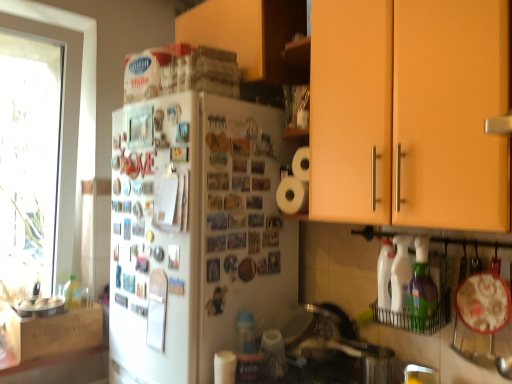
Where is `green plastic bottle at lower right, which is the first bottle in front-to-back order`? Image resolution: width=512 pixels, height=384 pixels. green plastic bottle at lower right, which is the first bottle in front-to-back order is located at coordinates (422, 287).

This screenshot has width=512, height=384. What are the coordinates of `matte orange cabinet at upper right, the second cabinetry ordered from the bottom` in the screenshot? It's located at (409, 113).

This screenshot has width=512, height=384. What do you see at coordinates (401, 274) in the screenshot?
I see `white plastic spray bottle at lower right, the 1th bottle in the back-to-front sequence` at bounding box center [401, 274].

At what (x,y) coordinates should I click in order to perform the action: click on green plastic bottle at lower right, which is the first bottle in front-to-back order. Please return your answer as a coordinate pair (x, y). Looking at the image, I should click on (422, 287).

Which is less distant, (219, 378) or (352, 60)?

Point (219, 378) is farther from the camera than point (352, 60).

Consider the image. Could you tell me if white matte paper towel at lower center is facing matte orange cabinet at upper right, placed as the second cabinetry when sorted from top to bottom?

No, white matte paper towel at lower center does not turn towards matte orange cabinet at upper right, placed as the second cabinetry when sorted from top to bottom.

In the scene shown: From a real-world perspective, between white matte paper towel at lower center and matte orange cabinet at upper right, placed as the second cabinetry when sorted from top to bottom, who is vertically higher?

matte orange cabinet at upper right, placed as the second cabinetry when sorted from top to bottom, is physically above.

Is white matte paper towel at lower center not near matte orange cabinet at upper right, the first cabinetry from the right?

No, white matte paper towel at lower center is not far from matte orange cabinet at upper right, the first cabinetry from the right.

From a real-world perspective, relative to white matte paper towel at lower center, is matte orange cabinet at upper right, the first cabinetry from the right, vertically above or below?

In terms of real-world spatial position, matte orange cabinet at upper right, the first cabinetry from the right, is above white matte paper towel at lower center.

Which object is closer to the camera taking this photo, matte orange cabinet at upper right, placed as the second cabinetry when sorted from top to bottom, or white matte paper towel at lower center?

matte orange cabinet at upper right, placed as the second cabinetry when sorted from top to bottom, is closer to the camera.

Considering the points (417, 58) and (217, 368), which point is behind, point (417, 58) or point (217, 368)?

The point (217, 368) is farther.

How different are the orientations of matte orange cabinet at upper right, the second cabinetry ordered from the bottom, and white matte paper towel at lower center in degrees?

matte orange cabinet at upper right, the second cabinetry ordered from the bottom, and white matte paper towel at lower center are facing 0.703 degrees away from each other.

Where is `the 1st bottle above the white matte paper towel at lower center (from the image's perspective)`? Image resolution: width=512 pixels, height=384 pixels. the 1st bottle above the white matte paper towel at lower center (from the image's perspective) is located at coordinates (422, 287).

Can you confirm if white matte paper towel at lower center is wider than green plastic bottle at lower right, which is the second bottle in back-to-front order?

No, white matte paper towel at lower center is not wider than green plastic bottle at lower right, which is the second bottle in back-to-front order.

Which of these two, white matte paper towel at lower center or green plastic bottle at lower right, which is the first bottle in front-to-back order, is smaller?

white matte paper towel at lower center is smaller.

Does white matte paper towel at lower center lie behind green plastic bottle at lower right, which is the second bottle in back-to-front order?

Yes, it is.

From a real-world perspective, is wooden cabinet at upper center, marked as the first cabinetry in a top-to-bottom arrangement, located beneath wooden crate at left, which appears as the first cabinetry when ordered from the bottom?

Incorrect, from a real-world perspective, wooden cabinet at upper center, marked as the first cabinetry in a top-to-bottom arrangement, is higher than wooden crate at left, which appears as the first cabinetry when ordered from the bottom.

Looking at this image, which is closer, (210, 4) or (93, 304)?

Clearly, point (210, 4) is closer to the camera than point (93, 304).

This screenshot has width=512, height=384. What are the coordinates of `the 2nd cabinetry positioned above the wooden crate at left, which is counted as the 1th cabinetry, starting from the left (from a real-world perspective)` in the screenshot? It's located at (249, 34).

Is wooden cabinet at upper center, marked as the first cabinetry in a top-to-bottom arrangement, behind wooden crate at left, which appears as the first cabinetry when ordered from the bottom?

No.

Which point is more distant from viewer, (x=73, y=346) or (x=234, y=374)?

Positioned behind is point (x=73, y=346).

Is wooden crate at left, acting as the third cabinetry starting from the top, thinner than white matte paper towel at lower center?

Incorrect, the width of wooden crate at left, acting as the third cabinetry starting from the top, is not less than that of white matte paper towel at lower center.

Would you say wooden crate at left, which appears as the first cabinetry when ordered from the bottom, is outside white matte paper towel at lower center?

That's correct, wooden crate at left, which appears as the first cabinetry when ordered from the bottom, is outside of white matte paper towel at lower center.

Is white plastic spray bottle at lower right, the 1th bottle in the back-to-front sequence, inside or outside of green plastic bottle at lower right, which is the first bottle in front-to-back order?

white plastic spray bottle at lower right, the 1th bottle in the back-to-front sequence, is not enclosed by green plastic bottle at lower right, which is the first bottle in front-to-back order.

From a real-world perspective, is white plastic spray bottle at lower right, the 1th bottle in the back-to-front sequence, above or below green plastic bottle at lower right, which is the second bottle in back-to-front order?

In terms of real-world spatial position, white plastic spray bottle at lower right, the 1th bottle in the back-to-front sequence, is above green plastic bottle at lower right, which is the second bottle in back-to-front order.

Is white plastic spray bottle at lower right, the second bottle in the front-to-back sequence, next to green plastic bottle at lower right, which is the second bottle in back-to-front order, and touching it?

Yes, white plastic spray bottle at lower right, the second bottle in the front-to-back sequence, and green plastic bottle at lower right, which is the second bottle in back-to-front order, clearly make contact.

Considering the relative positions of white matte refrigerator at center and white plastic spray bottle at lower right, the second bottle in the front-to-back sequence, in the image provided, is white matte refrigerator at center behind white plastic spray bottle at lower right, the second bottle in the front-to-back sequence,?

Yes, white matte refrigerator at center is further from the camera.

The image size is (512, 384). In the image, there is a white plastic spray bottle at lower right, the second bottle in the front-to-back sequence. Identify the location of refrigerator below it (from the image's perspective). (194, 233).

Based on their positions, is white matte refrigerator at center located to the left or right of white plastic spray bottle at lower right, the 1th bottle in the back-to-front sequence?

Clearly, white matte refrigerator at center is on the left of white plastic spray bottle at lower right, the 1th bottle in the back-to-front sequence, in the image.

Find the location of a particular element. paper towel on the left of matte orange cabinet at upper right, the first cabinetry from the right is located at coordinates (224, 367).

There is a white matte paper towel at lower center. Find the location of `the 2nd cabinetry above it (from a real-world perspective)`. the 2nd cabinetry above it (from a real-world perspective) is located at coordinates (409, 113).

From the image, which object appears to be nearer to white matte paper towel at lower center, wooden crate at left, which is counted as the 1th cabinetry, starting from the left, or white matte refrigerator at center?

Based on the image, white matte refrigerator at center appears to be nearer to white matte paper towel at lower center.

Which object lies nearer to the anchor point white matte refrigerator at center, white matte paper towel at lower center or wooden crate at left, which is counted as the 1th cabinetry, starting from the left?

The object closer to white matte refrigerator at center is white matte paper towel at lower center.

Looking at this image, estimate the real-world distances between objects in this image. Which object is closer to wooden crate at left, the third cabinetry viewed from the right, matte orange cabinet at upper right, the third cabinetry positioned from the left, or white matte paper towel at lower center?

white matte paper towel at lower center is positioned closer to the anchor wooden crate at left, the third cabinetry viewed from the right.

Estimate the real-world distances between objects in this image. Which object is further from matte orange cabinet at upper right, the third cabinetry positioned from the left, wooden cabinet at upper center, the 2th cabinetry viewed from the left, or wooden crate at left, which appears as the first cabinetry when ordered from the bottom?

Among the two, wooden crate at left, which appears as the first cabinetry when ordered from the bottom, is located further to matte orange cabinet at upper right, the third cabinetry positioned from the left.

Based on the photo, based on their spatial positions, is wooden cabinet at upper center, acting as the third cabinetry starting from the bottom, or matte orange cabinet at upper right, the third cabinetry positioned from the left, closer to wooden crate at left, the third cabinetry viewed from the right?

Among the two, wooden cabinet at upper center, acting as the third cabinetry starting from the bottom, is located nearer to wooden crate at left, the third cabinetry viewed from the right.

Which object lies nearer to the anchor point matte orange cabinet at upper right, the third cabinetry positioned from the left, white matte paper towel at lower center or white matte refrigerator at center?

white matte refrigerator at center lies closer to matte orange cabinet at upper right, the third cabinetry positioned from the left, than the other object.

When comparing their distances from wooden crate at left, which appears as the first cabinetry when ordered from the bottom, does wooden cabinet at upper center, acting as the third cabinetry starting from the bottom, or green plastic bottle at lower right, which is the first bottle in front-to-back order, seem closer?

Among the two, wooden cabinet at upper center, acting as the third cabinetry starting from the bottom, is located nearer to wooden crate at left, which appears as the first cabinetry when ordered from the bottom.

Which object lies nearer to the anchor point white plastic spray bottle at lower right, the second bottle in the front-to-back sequence, green plastic bottle at lower right, which is the first bottle in front-to-back order, or wooden crate at left, which is counted as the 1th cabinetry, starting from the left?

green plastic bottle at lower right, which is the first bottle in front-to-back order, is closer to white plastic spray bottle at lower right, the second bottle in the front-to-back sequence.

Where is `cabinetry between wooden crate at left, which is counted as the 1th cabinetry, starting from the left, and matte orange cabinet at upper right, the second cabinetry ordered from the bottom, in the horizontal direction`? This screenshot has height=384, width=512. cabinetry between wooden crate at left, which is counted as the 1th cabinetry, starting from the left, and matte orange cabinet at upper right, the second cabinetry ordered from the bottom, in the horizontal direction is located at coordinates (249, 34).

At what (x,y) coordinates should I click in order to perform the action: click on refrigerator located between wooden crate at left, the third cabinetry viewed from the right, and matte orange cabinet at upper right, the second cabinetry ordered from the bottom, in the left-right direction. Please return your answer as a coordinate pair (x, y). Looking at the image, I should click on (194, 233).

Where is `paper towel located between white matte refrigerator at center and green plastic bottle at lower right, which is the first bottle in front-to-back order, in the left-right direction`? The width and height of the screenshot is (512, 384). paper towel located between white matte refrigerator at center and green plastic bottle at lower right, which is the first bottle in front-to-back order, in the left-right direction is located at coordinates (224, 367).

Where is `bottle between matte orange cabinet at upper right, placed as the second cabinetry when sorted from top to bottom, and green plastic bottle at lower right, which is the first bottle in front-to-back order, in the vertical direction`? bottle between matte orange cabinet at upper right, placed as the second cabinetry when sorted from top to bottom, and green plastic bottle at lower right, which is the first bottle in front-to-back order, in the vertical direction is located at coordinates (401, 274).